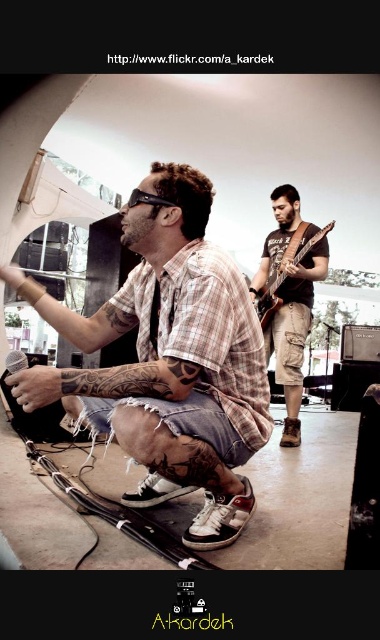
Who is shorter, plaid shirt at center or wooden electric guitar at center?

With less height is wooden electric guitar at center.

Looking at this image, is plaid shirt at center above wooden electric guitar at center?

No.

Between point (15, 374) and point (275, 304), which one is positioned in front?

Point (15, 374) is more forward.

Locate an element on the screen. plaid shirt at center is located at coordinates pyautogui.click(x=169, y=358).

The width and height of the screenshot is (380, 640). What do you see at coordinates (289, 298) in the screenshot?
I see `brown leather guitar at center` at bounding box center [289, 298].

In the scene shown: Can you confirm if brown leather guitar at center is bigger than wooden electric guitar at center?

Yes, brown leather guitar at center is bigger than wooden electric guitar at center.

At what (x,y) coordinates should I click in order to perform the action: click on brown leather guitar at center. Please return your answer as a coordinate pair (x, y). Looking at the image, I should click on (289, 298).

Is plaid shirt at center to the left of brown leather guitar at center from the viewer's perspective?

Yes, plaid shirt at center is to the left of brown leather guitar at center.

Describe the element at coordinates (169, 358) in the screenshot. I see `plaid shirt at center` at that location.

At what (x,y) coordinates should I click in order to perform the action: click on plaid shirt at center. Please return your answer as a coordinate pair (x, y). This screenshot has width=380, height=640. Looking at the image, I should click on [169, 358].